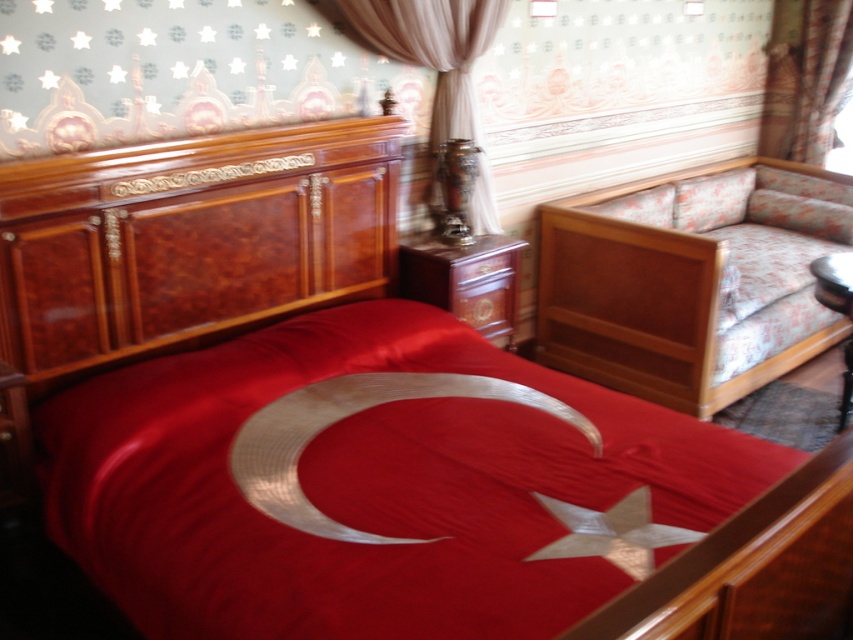
You are an interior designer assessing the placement of furniture in the room. You notice the burlwood headboard at left and the wooden bed frame at right. Which object is shorter in height?

The burlwood headboard at left is not as tall as the wooden bed frame at right, so the burlwood headboard at left is shorter in height.

You are standing in the room and want to hang a new picture frame. The frame is 1 meter wide. There is a burlwood headboard at left and a satin curtain at upper right. Which object should you place the frame in front of so it is visible from the entrance?

The satin curtain at upper right should be chosen because the burlwood headboard at left is in front of it, so placing the frame in front of the satin curtain at upper right would make it visible behind the headboard.